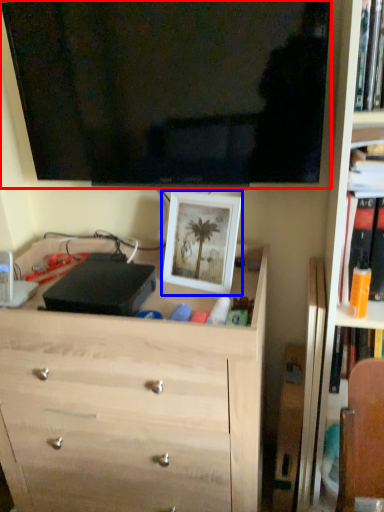
Question: Among these objects, which one is farthest to the camera, television (highlighted by a red box) or picture frame (highlighted by a blue box)?

Choices:
 (A) television
 (B) picture frame

Answer: (B)